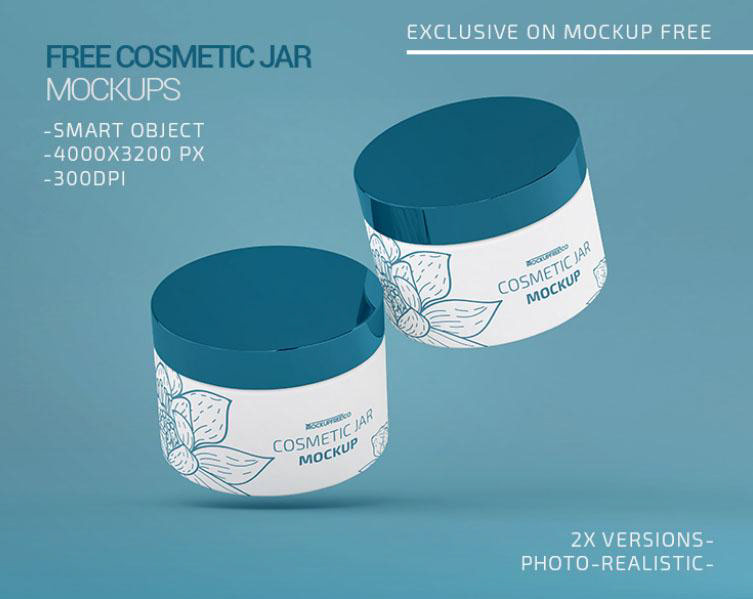
At what (x,y) coordinates should I click in order to perform the action: click on jar (text). Please return your answer as a coordinate pair (x, y). Looking at the image, I should click on (366, 417).